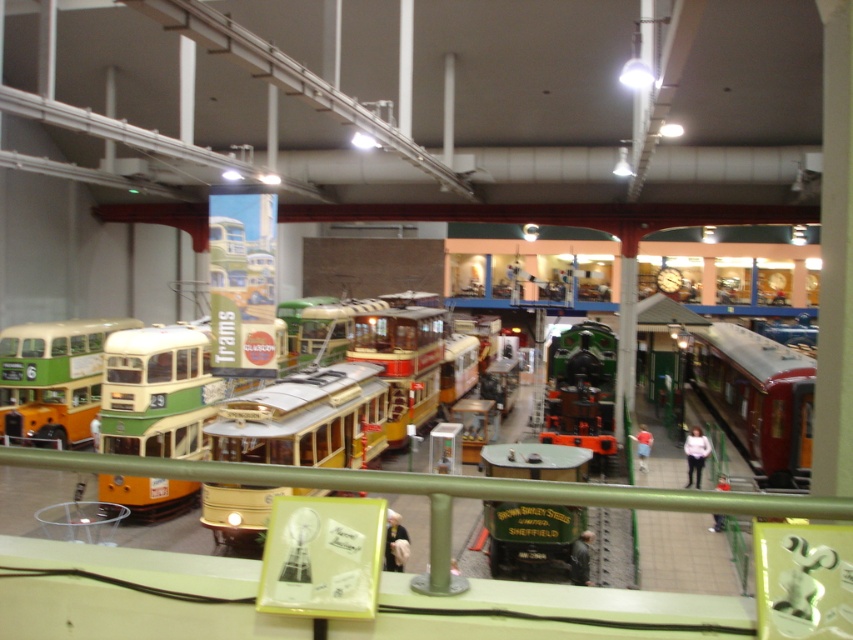
Looking at this image, which of these two, gold metallic tram at center or green matte double-decker bus at left, stands taller?

With more height is gold metallic tram at center.

Does gold metallic tram at center have a greater height compared to green matte double-decker bus at left?

Indeed, gold metallic tram at center has a greater height compared to green matte double-decker bus at left.

Between point (294, 419) and point (9, 369), which one is positioned in front?

Point (294, 419) is more forward.

In order to click on gold metallic tram at center in this screenshot , I will do `click(305, 419)`.